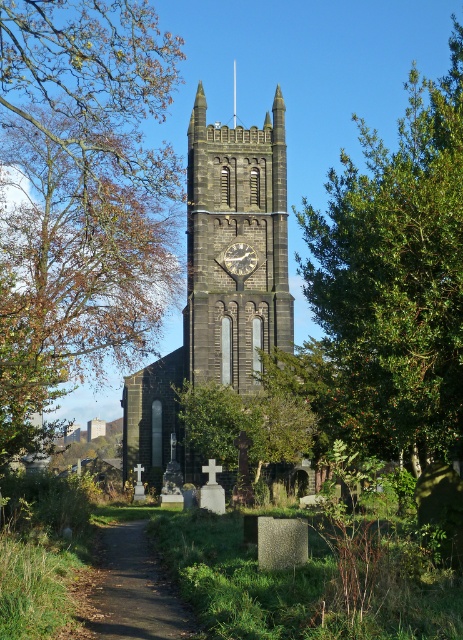
Question: Can you confirm if dark gray stone church tower at center is thinner than silver metallic clock at center?

Choices:
 (A) yes
 (B) no

Answer: (B)

Question: Is green leafy tree at upper right bigger than brown dirt path at lower left?

Choices:
 (A) no
 (B) yes

Answer: (B)

Question: Estimate the real-world distances between objects in this image. Which object is farther from the brown dirt path at lower left?

Choices:
 (A) dark gray stone church tower at center
 (B) green leafy tree at upper right
 (C) brown leafy tree at left
 (D) dark gray stone clock tower at center

Answer: (C)

Question: From the image, what is the correct spatial relationship of dark gray stone clock tower at center in relation to silver metallic clock at center?

Choices:
 (A) left
 (B) right

Answer: (A)

Question: Which of the following is the closest to the observer?

Choices:
 (A) brown dirt path at lower left
 (B) dark gray stone church tower at center

Answer: (A)

Question: Which is nearer to the brown dirt path at lower left?

Choices:
 (A) green leafy tree at upper right
 (B) brown leafy tree at left

Answer: (A)